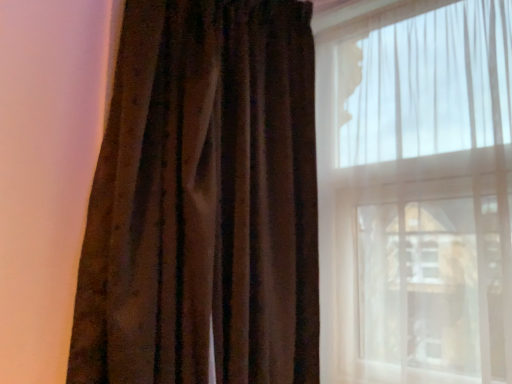
Question: Considering the positions of point (97, 238) and point (320, 69), is point (97, 238) closer or farther from the camera than point (320, 69)?

Choices:
 (A) closer
 (B) farther

Answer: (A)

Question: In the image, is velvet brown curtain at left positioned in front of or behind translucent white curtain at right?

Choices:
 (A) behind
 (B) front

Answer: (B)

Question: From their relative heights in the image, would you say velvet brown curtain at left is taller or shorter than translucent white curtain at right?

Choices:
 (A) short
 (B) tall

Answer: (B)

Question: Considering the positions of translucent white curtain at right and velvet brown curtain at left in the image, is translucent white curtain at right wider or thinner than velvet brown curtain at left?

Choices:
 (A) wide
 (B) thin

Answer: (B)

Question: In terms of size, does translucent white curtain at right appear bigger or smaller than velvet brown curtain at left?

Choices:
 (A) small
 (B) big

Answer: (A)

Question: From the image's perspective, relative to velvet brown curtain at left, is translucent white curtain at right above or below?

Choices:
 (A) above
 (B) below

Answer: (B)

Question: Visually, is translucent white curtain at right positioned to the left or to the right of velvet brown curtain at left?

Choices:
 (A) left
 (B) right

Answer: (B)